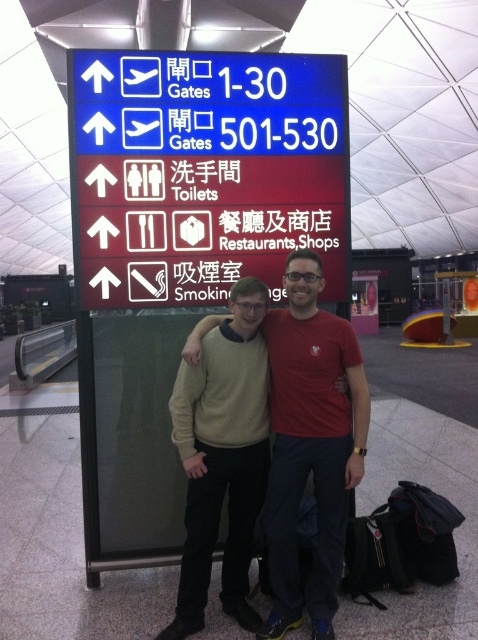
Which of these two, blue plastic sign at upper center or red t-shirt at center, stands shorter?

blue plastic sign at upper center is shorter.

Does blue plastic sign at upper center appear over red t-shirt at center?

Correct, blue plastic sign at upper center is located above red t-shirt at center.

Is point (238, 97) closer to camera compared to point (284, 625)?

That is False.

This screenshot has height=640, width=478. Find the location of `blue plastic sign at upper center`. blue plastic sign at upper center is located at coordinates (205, 172).

Does red t-shirt at center have a greater height compared to beige sweater at center?

Correct, red t-shirt at center is much taller as beige sweater at center.

Is point (360, 372) positioned after point (205, 605)?

That is True.

Measure the distance between red t-shirt at center and camera.

8.20 feet

Where is `red t-shirt at center`? The height and width of the screenshot is (640, 478). red t-shirt at center is located at coordinates (311, 442).

Between blue plastic sign at upper center and beige sweater at center, which one has more height?

Standing taller between the two is beige sweater at center.

Is point (284, 90) in front of point (230, 484)?

No, it is behind (230, 484).

The height and width of the screenshot is (640, 478). What are the coordinates of `blue plastic sign at upper center` in the screenshot? It's located at (205, 172).